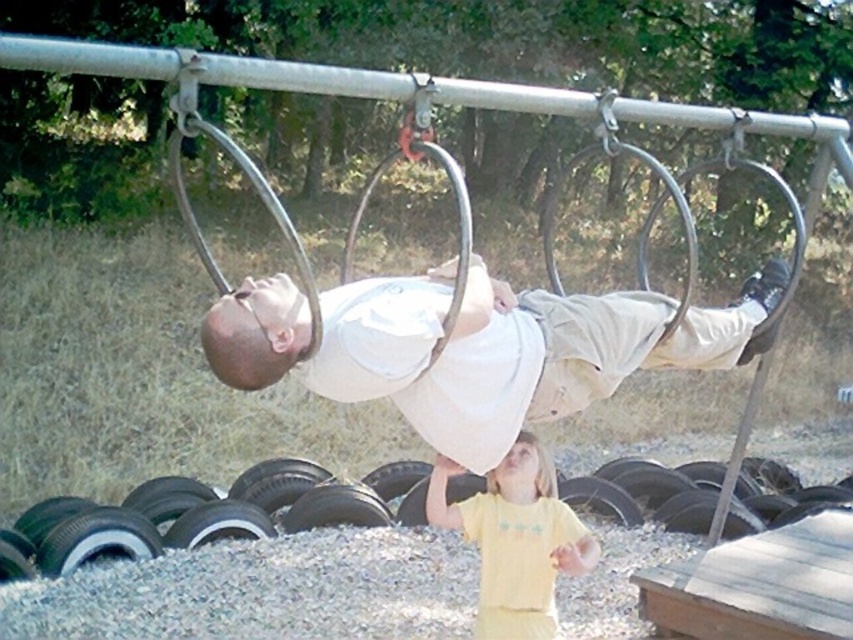
How far apart are white cotton shirt at center and black rubber tire at lower center?

The distance of white cotton shirt at center from black rubber tire at lower center is 9.37 feet.

Is white cotton shirt at center to the right of black rubber tire at lower center from the viewer's perspective?

Indeed, white cotton shirt at center is positioned on the right side of black rubber tire at lower center.

Find the location of `white cotton shirt at center`. white cotton shirt at center is located at coordinates tap(511, 352).

Find the location of a particular element. white cotton shirt at center is located at coordinates (511, 352).

Does white cotton shirt at center have a smaller size compared to yellow cotton shirt at lower center?

No.

Who is taller, white cotton shirt at center or yellow cotton shirt at lower center?

yellow cotton shirt at lower center

The image size is (853, 640). Find the location of `white cotton shirt at center`. white cotton shirt at center is located at coordinates (511, 352).

Locate an element on the screen. This screenshot has width=853, height=640. white cotton shirt at center is located at coordinates (511, 352).

Does point (189, 524) lie behind point (550, 508)?

That is True.

Is point (708, 499) positioned before point (549, 506)?

No, it is not.

Locate an element on the screen. The image size is (853, 640). black rubber tire at lower center is located at coordinates (204, 515).